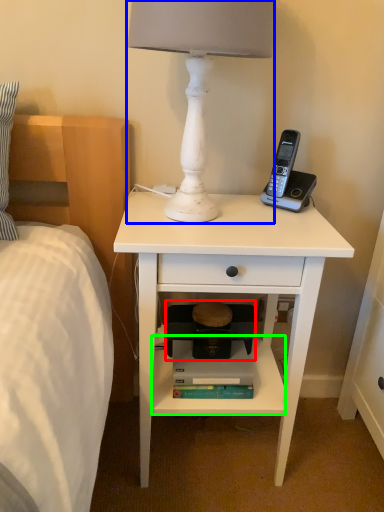
Question: Which object is positioned closest to step stool (highlighted by a red box)? Select from lamp (highlighted by a blue box) and shelf (highlighted by a green box).

Choices:
 (A) lamp
 (B) shelf

Answer: (B)